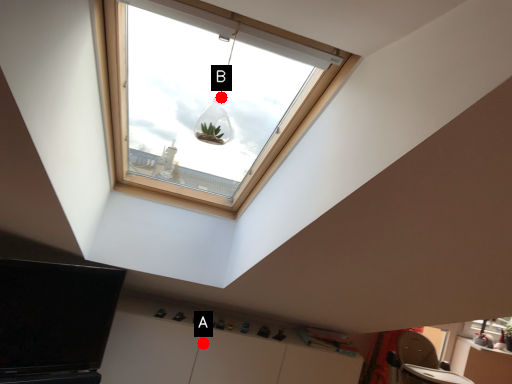
Question: Two points are circled on the image, labeled by A and B beside each circle. Which point is further to the camera?

Choices:
 (A) A is further
 (B) B is further

Answer: (A)